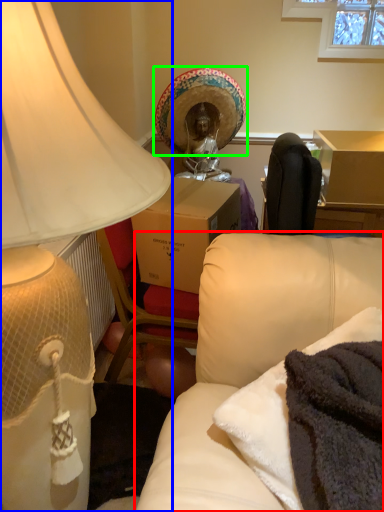
Question: Which object is the farthest from studio couch (highlighted by a red box)? Choose among these: lamp (highlighted by a blue box) or headdress (highlighted by a green box).

Choices:
 (A) lamp
 (B) headdress

Answer: (B)